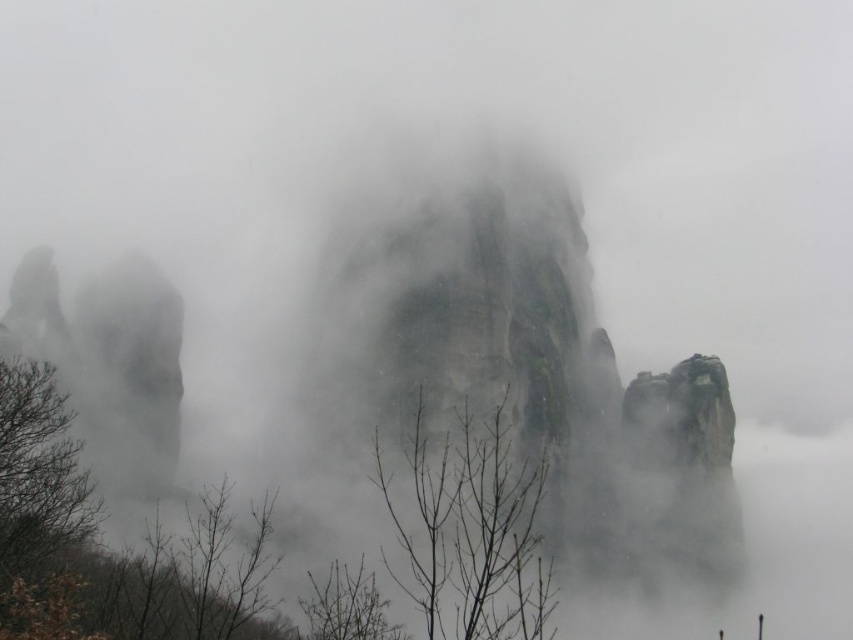
Question: Among these objects, which one is nearest to the camera?

Choices:
 (A) brown leafless tree at lower center
 (B) brown leafless branches at lower left

Answer: (B)

Question: Which object is positioned closest to the brown bare branches at center?

Choices:
 (A) brown leafless tree at lower center
 (B) brown leafless branches at lower left
 (C) brown leafy tree at lower left

Answer: (A)

Question: Observing the image, what is the correct spatial positioning of brown bare branches at center in reference to brown leafless tree at lower center?

Choices:
 (A) left
 (B) right

Answer: (B)

Question: Estimate the real-world distances between objects in this image. Which object is farther from the brown leafless tree at lower center?

Choices:
 (A) brown leafless branches at lower left
 (B) brown leafy tree at lower left

Answer: (A)

Question: From the image, what is the correct spatial relationship of brown leafless branches at lower left in relation to brown leafless tree at lower center?

Choices:
 (A) left
 (B) right

Answer: (A)

Question: Is brown leafy tree at lower left to the left of brown leafless branches at lower left from the viewer's perspective?

Choices:
 (A) no
 (B) yes

Answer: (B)